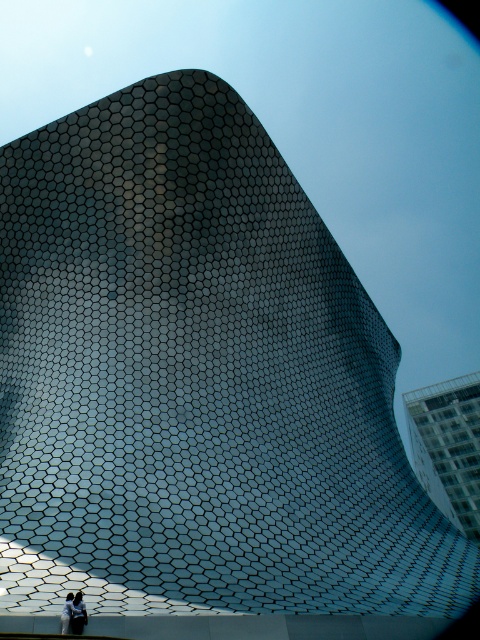
Identify the location of glassy reflective building at upper right. Image resolution: width=480 pixels, height=640 pixels. (447, 445).

Is glassy reflective building at upper right shorter than white fabric person at lower left?

No, glassy reflective building at upper right is not shorter than white fabric person at lower left.

Which is in front, point (466, 433) or point (75, 624)?

Point (75, 624)

Locate an element on the screen. glassy reflective building at upper right is located at coordinates pyautogui.click(x=447, y=445).

Does white fabric person at lower left have a smaller size compared to light blue fabric at center?

Actually, white fabric person at lower left might be larger than light blue fabric at center.

Who is shorter, white fabric person at lower left or light blue fabric at center?

With less height is light blue fabric at center.

Locate an element on the screen. This screenshot has width=480, height=640. white fabric person at lower left is located at coordinates pyautogui.click(x=78, y=612).

I want to click on white fabric person at lower left, so click(78, 612).

Between glassy reflective building at upper right and light blue fabric at center, which one is positioned higher?

light blue fabric at center

Identify the location of glassy reflective building at upper right. The height and width of the screenshot is (640, 480). pyautogui.click(x=447, y=445).